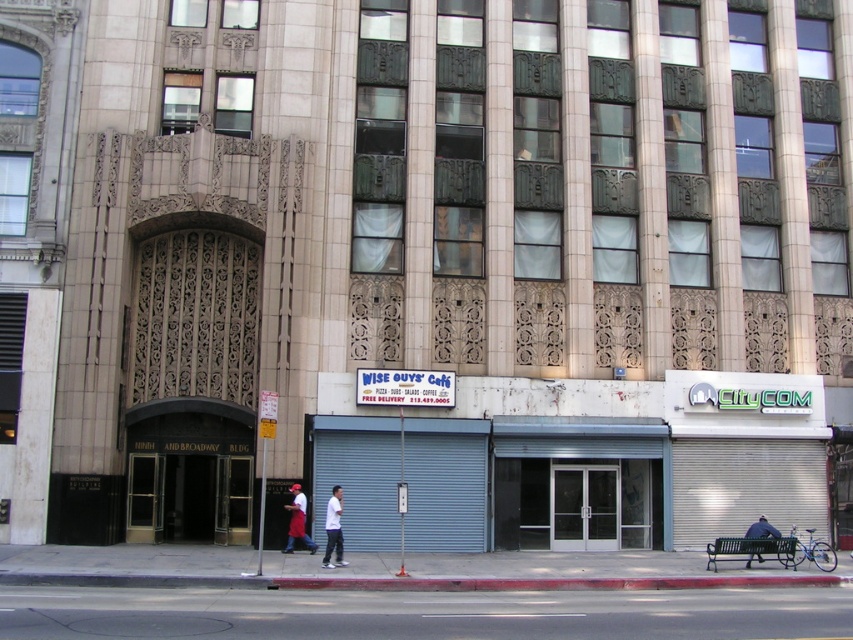
Question: Does red apron at center come in front of blue fabric jacket at lower right?

Choices:
 (A) no
 (B) yes

Answer: (A)

Question: Is white matte shirt at center closer to the viewer compared to blue fabric jacket at lower right?

Choices:
 (A) no
 (B) yes

Answer: (B)

Question: Which point is closer to the camera taking this photo?

Choices:
 (A) (746, 536)
 (B) (329, 508)

Answer: (B)

Question: Which point is farther to the camera?

Choices:
 (A) (764, 536)
 (B) (152, 547)
 (C) (326, 532)
 (D) (289, 513)

Answer: (B)

Question: Which point appears farthest from the camera in this image?

Choices:
 (A) (303, 500)
 (B) (234, 600)
 (C) (337, 493)

Answer: (A)

Question: Does red apron at center lie behind blue fabric jacket at lower right?

Choices:
 (A) yes
 (B) no

Answer: (A)